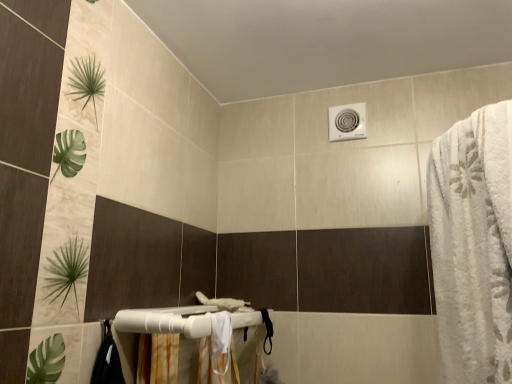
Question: From a real-world perspective, is white fluffy bath towel at right above or below white plastic towel bar at lower center?

Choices:
 (A) below
 (B) above

Answer: (B)

Question: Relative to white plastic towel bar at lower center, is white fluffy bath towel at right in front or behind?

Choices:
 (A) behind
 (B) front

Answer: (B)

Question: Which object is the closest to the white fluffy bath towel at right?

Choices:
 (A) white plastic towel bar at lower center
 (B) white fabric shower curtain at lower center

Answer: (B)

Question: Estimate the real-world distances between objects in this image. Which object is farther from the white plastic towel bar at lower center?

Choices:
 (A) white fluffy bath towel at right
 (B) white fabric shower curtain at lower center

Answer: (A)